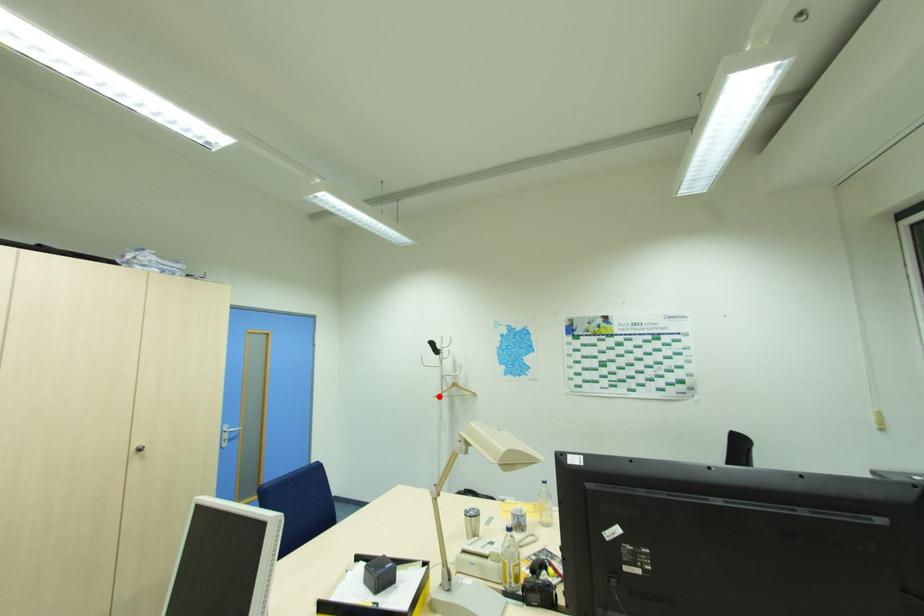
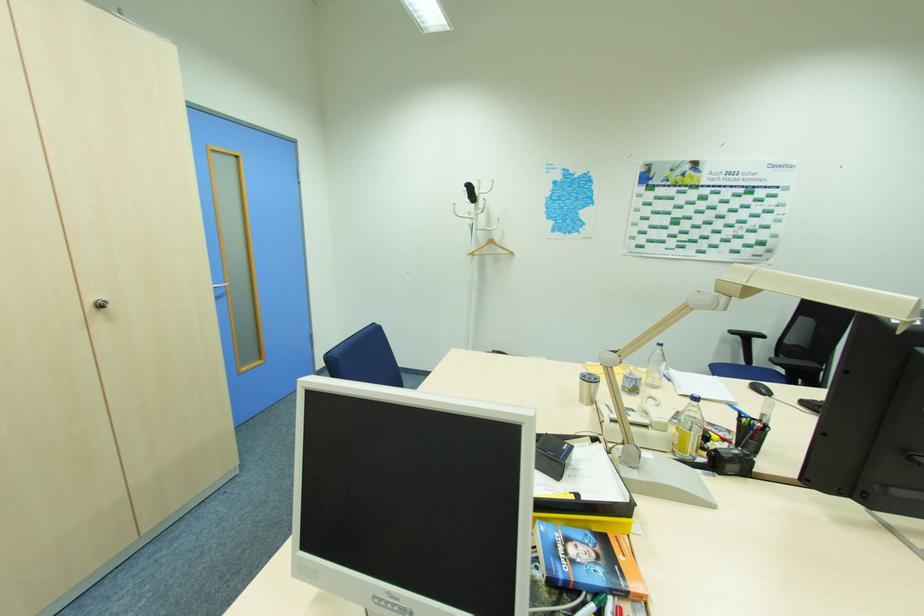
Question: I am providing you with two images of the same scene from different viewpoints. A red point is shown in image1. For the corresponding object point in image2, is it positioned nearer or farther from the camera?

Choices:
 (A) Nearer
 (B) Farther

Answer: (A)